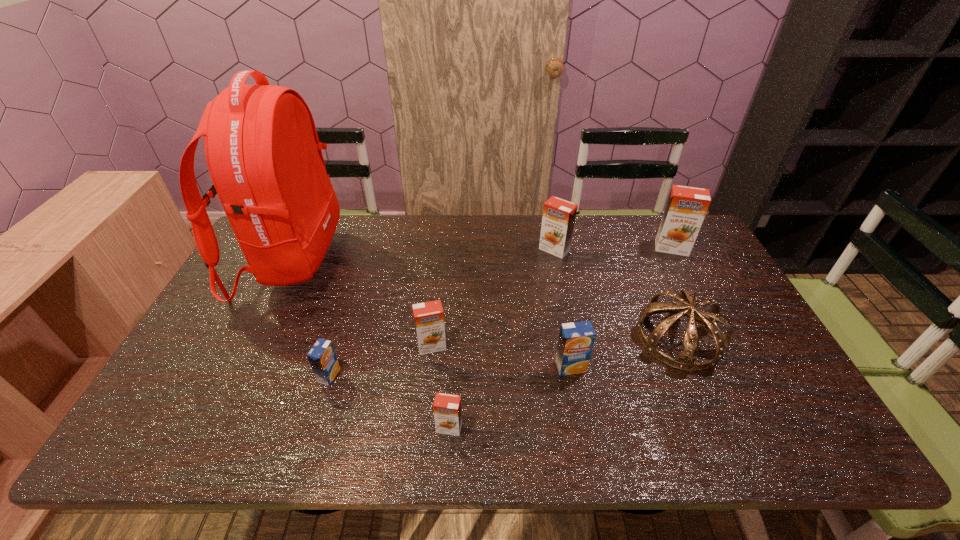
Where is `the tallest object`? The width and height of the screenshot is (960, 540). the tallest object is located at coordinates (262, 149).

You are a GUI agent. You are given a task and a screenshot of the screen. Output one action in this format:
    pyautogui.click(x=<x>, y=<y>)
    Task: Click on the backpack
    
    Given the screenshot: What is the action you would take?
    pyautogui.click(x=262, y=149)

At what (x,y) coordinates should I click in order to perform the action: click on the seventh shortest object. Please return your answer as a coordinate pair (x, y). The height and width of the screenshot is (540, 960). Looking at the image, I should click on (686, 207).

In order to click on the rightmost orange juice in this screenshot , I will do `click(686, 207)`.

Identify the location of the third tallest object. This screenshot has height=540, width=960. (558, 220).

Locate an element on the screen. the third smallest orange orange juice is located at coordinates (558, 220).

Where is `brown tiara`? brown tiara is located at coordinates coord(685,360).

You are a GUI agent. You are given a task and a screenshot of the screen. Output one action in this format:
    pyautogui.click(x=<x>, y=<y>)
    Task: Click on the third farthest orange juice
    This screenshot has width=960, height=540.
    Given the screenshot: What is the action you would take?
    pyautogui.click(x=429, y=316)

Where is `the second smallest orange orange juice`? The width and height of the screenshot is (960, 540). the second smallest orange orange juice is located at coordinates (429, 316).

Locate an element on the screen. The height and width of the screenshot is (540, 960). the bigger blue orange_juice is located at coordinates (576, 340).